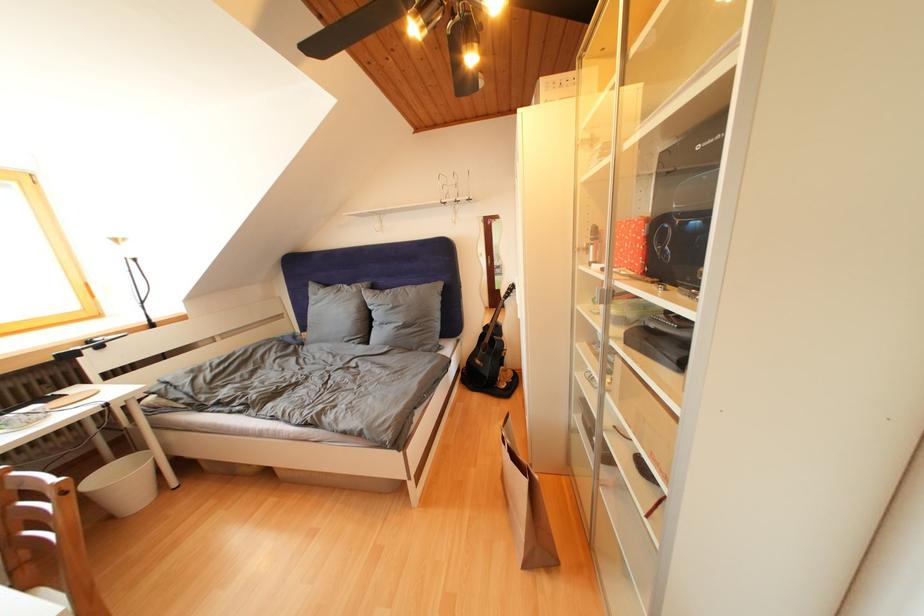
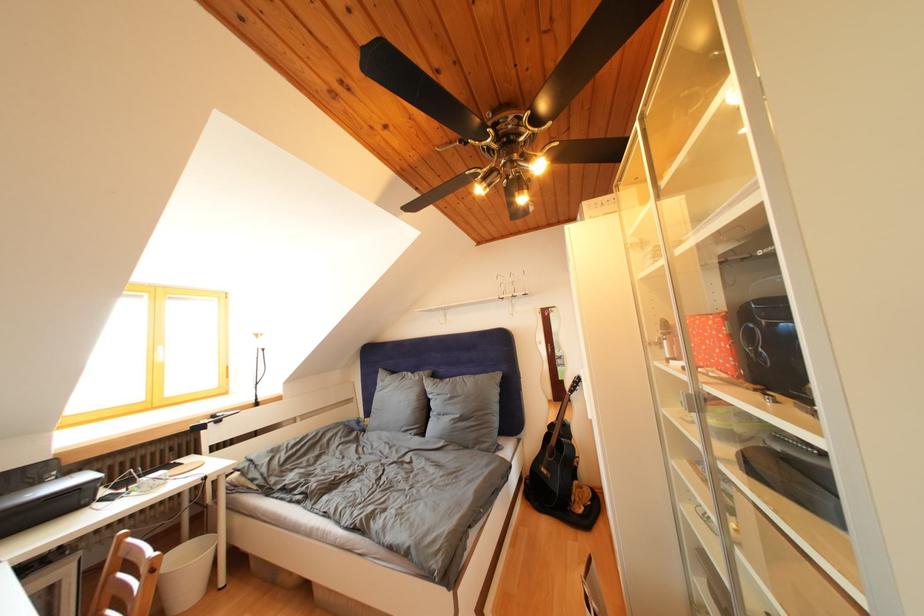
Locate, in the second image, the point that corresponds to the point at 362,294 in the first image.

(426, 383)